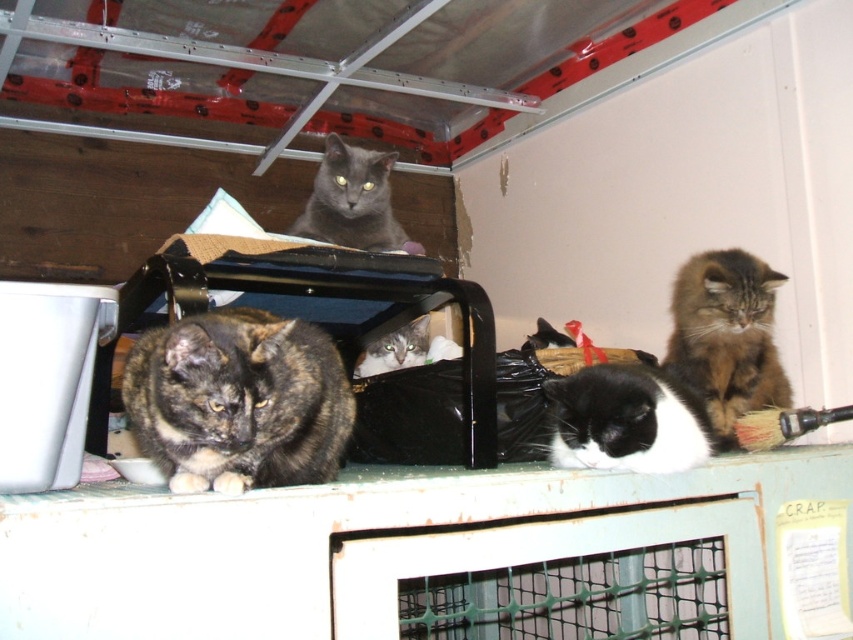
Which of these two, tabby fur cat at upper right or gray fur cat at center, stands taller?

With more height is tabby fur cat at upper right.

Between tabby fur cat at upper right and gray fur cat at center, which one is positioned higher?

tabby fur cat at upper right is higher up.

You are a GUI agent. You are given a task and a screenshot of the screen. Output one action in this format:
    pyautogui.click(x=<x>, y=<y>)
    Task: Click on the tabby fur cat at upper right
    
    Given the screenshot: What is the action you would take?
    pyautogui.click(x=727, y=336)

Where is `tabby fur cat at upper right`? This screenshot has height=640, width=853. tabby fur cat at upper right is located at coordinates (727, 336).

Between black and white fur cat at center and metallic silver exhaust hood at upper center, which one has less height?

Standing shorter between the two is black and white fur cat at center.

Does point (624, 429) come farther from viewer compared to point (292, 154)?

No, it is in front of (292, 154).

Is point (560, 452) closer to camera compared to point (166, 134)?

That is True.

Image resolution: width=853 pixels, height=640 pixels. I want to click on black and white fur cat at center, so click(x=625, y=420).

Is white plastic ledge at center wider than tabby fur cat at upper right?

Correct, the width of white plastic ledge at center exceeds that of tabby fur cat at upper right.

Who is positioned more to the left, white plastic ledge at center or tabby fur cat at upper right?

From the viewer's perspective, white plastic ledge at center appears more on the left side.

Based on the photo, measure the distance between point (x=593, y=582) and camera.

Point (x=593, y=582) and camera are 5.45 feet apart.

Where is `white plastic ledge at center`? white plastic ledge at center is located at coordinates (434, 556).